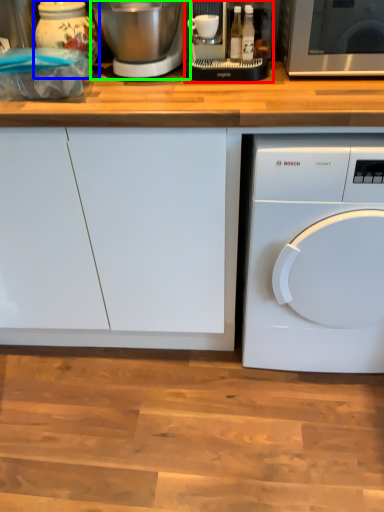
Question: Which object is the farthest from food processor (highlighted by a red box)? Choose among these: appliance (highlighted by a blue box) or mixer (highlighted by a green box).

Choices:
 (A) appliance
 (B) mixer

Answer: (A)